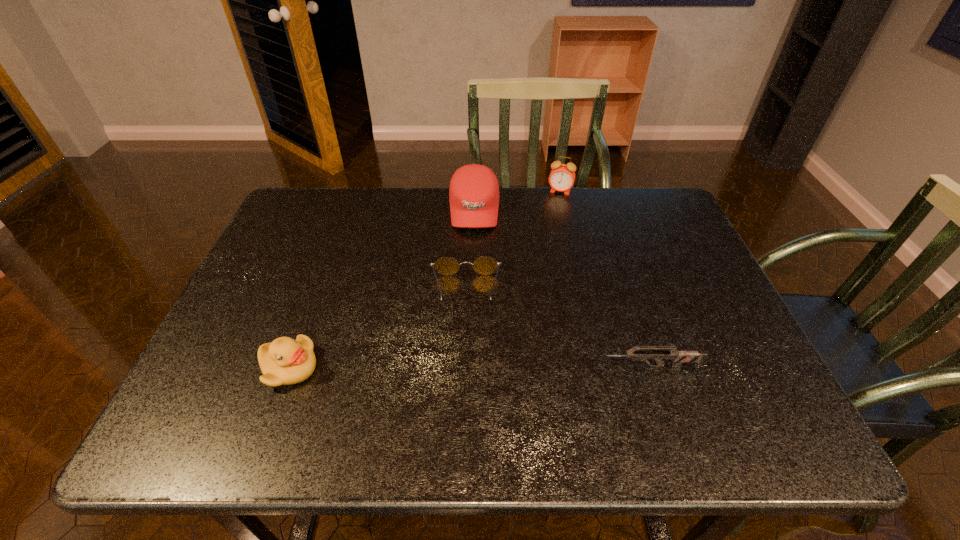
At what (x,y) coordinates should I click in order to perform the action: click on free spot on the desktop that is between the third tallest object and the gun and is positioned on the front-facing side of the third farthest object. Please return your answer as a coordinate pair (x, y). This screenshot has width=960, height=540. Looking at the image, I should click on [466, 367].

Identify the location of vacant space on the desktop that is between the third tallest object and the gun and is positioned on the front-facing side of the cap. This screenshot has height=540, width=960. (473, 367).

This screenshot has width=960, height=540. I want to click on free spot on the desktop that is between the third shortest object and the gun and is positioned on the face of the alarm clock, so click(510, 367).